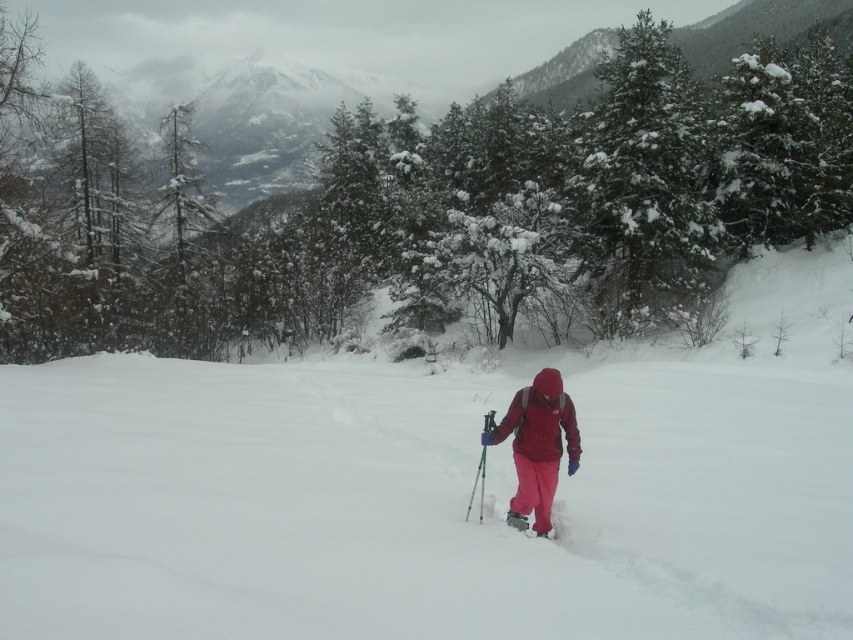
Can you confirm if snow-covered evergreen tree at center is smaller than matte red jacket at center?

Actually, snow-covered evergreen tree at center might be larger than matte red jacket at center.

Consider the image. Can you confirm if snow-covered evergreen tree at center is wider than matte red jacket at center?

Yes.

Is point (204, 269) in front of point (531, 388)?

No, (204, 269) is behind (531, 388).

Image resolution: width=853 pixels, height=640 pixels. In order to click on snow-covered evergreen tree at center in this screenshot , I will do click(433, 195).

Which is more to the left, snow-covered evergreen tree at center or snow-covered evergreen at upper right?

From the viewer's perspective, snow-covered evergreen tree at center appears more on the left side.

Is snow-covered evergreen tree at center thinner than snow-covered evergreen at upper right?

No, snow-covered evergreen tree at center is not thinner than snow-covered evergreen at upper right.

Where is `snow-covered evergreen tree at center`? Image resolution: width=853 pixels, height=640 pixels. snow-covered evergreen tree at center is located at coordinates (433, 195).

You are a GUI agent. You are given a task and a screenshot of the screen. Output one action in this format:
    pyautogui.click(x=<x>, y=<y>)
    Task: Click on the snow-covered evergreen tree at center
    This screenshot has height=640, width=853.
    Given the screenshot: What is the action you would take?
    pyautogui.click(x=433, y=195)

In the scene shown: Can you confirm if matte red jacket at center is positioned above pink matte ski at center?

Yes, matte red jacket at center is above pink matte ski at center.

Which is behind, point (570, 432) or point (554, 529)?

Point (554, 529)

Where is `matte red jacket at center`? Image resolution: width=853 pixels, height=640 pixels. matte red jacket at center is located at coordinates (537, 445).